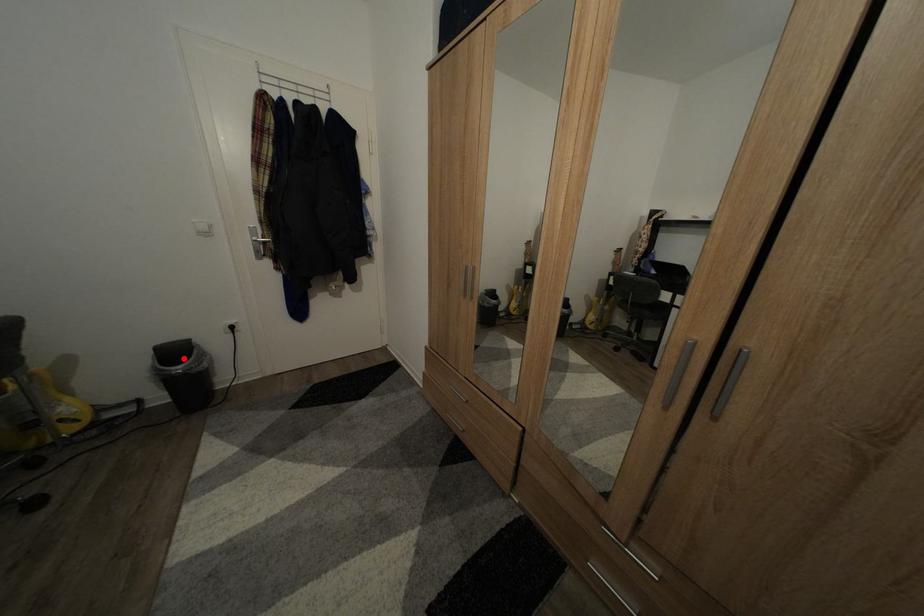
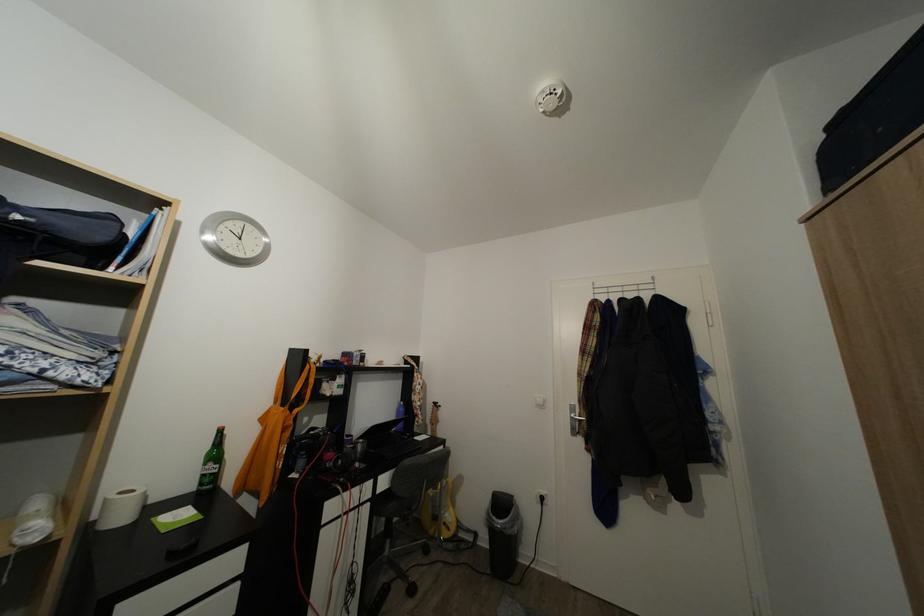
Question: A red point is marked in image1. In image2, is the corresponding 3D point closer to the camera or farther? Reply with the corresponding letter.

Choices:
 (A) The corresponding 3D point is closer.
 (B) The corresponding 3D point is farther.

Answer: (B)